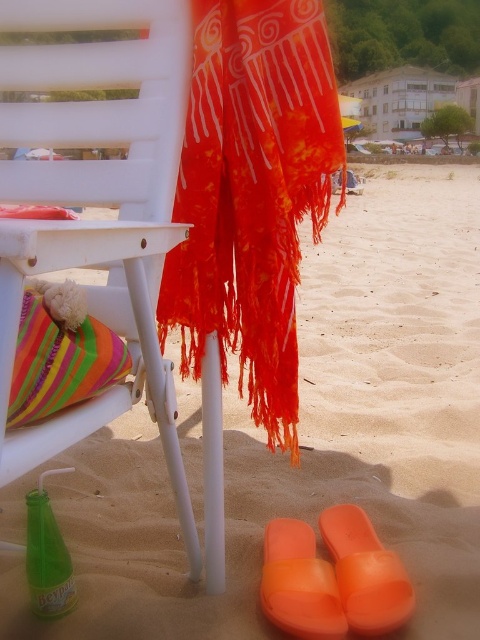
You are standing at the center of the beach scene and want to place a striped fabric pillow at lower left. Where should you place it?

You should place the striped fabric pillow at lower left at point (x=60, y=355).

You are a photographer setting up equipment on the beach. You have a white plastic chair at upper left and a green glass bottle at lower left in your shot. Which object will appear larger in your photo?

The white plastic chair at upper left is taller than the green glass bottle at lower left, so it will appear larger in the photo.

You are a photographer setting up a shot of the striped fabric pillow at lower left and the green glass bottle at lower left. Which object should you adjust to place them side by side without overlapping?

The striped fabric pillow at lower left is to the right of green glass bottle at lower left, so you should move the striped fabric pillow at lower left to the left or move the green glass bottle at lower left to the right to avoid overlapping when placing them side by side.